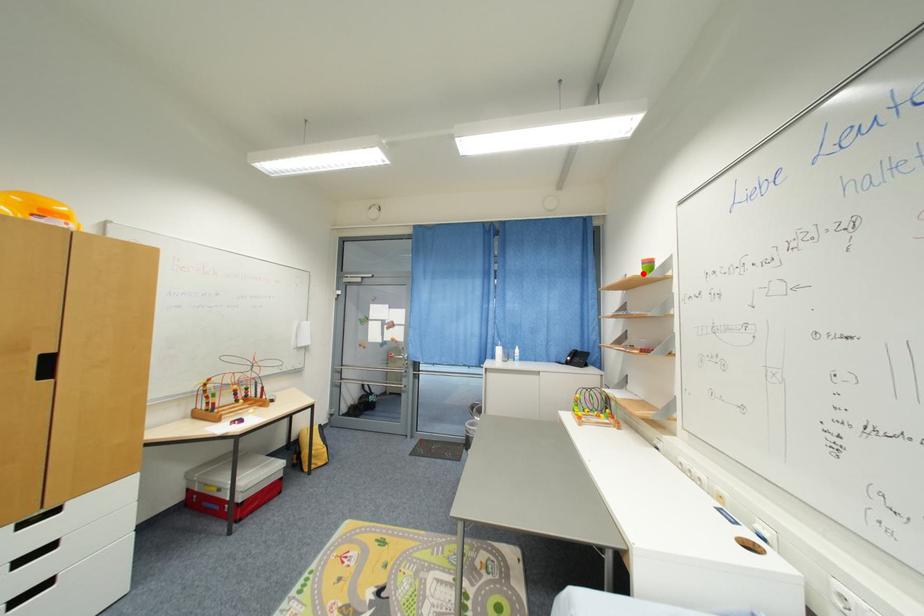
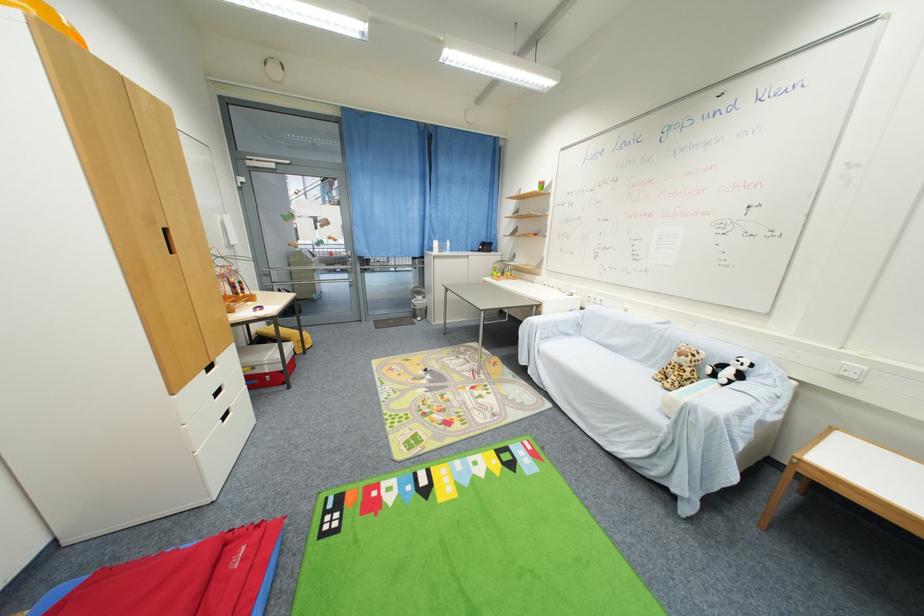
Find the pixel in the second image that matches the highlighted location in the first image.

(541, 190)